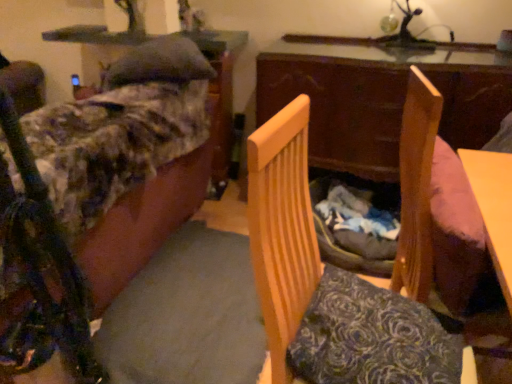
Question: Which is correct: wooden swivel chair at right is inside wooden chair at center, the 1th furniture positioned from the right, or outside of it?

Choices:
 (A) inside
 (B) outside

Answer: (B)

Question: Looking at the image, does wooden swivel chair at right seem bigger or smaller compared to wooden chair at center, the 2th furniture viewed from the left?

Choices:
 (A) small
 (B) big

Answer: (A)

Question: Estimate the real-world distances between objects in this image. Which object is farther from the wooden table at center?

Choices:
 (A) wooden swivel chair at right
 (B) wooden chair at center, the 2th furniture viewed from the left
 (C) fluffy fabric couch at left, positioned as the second furniture in right-to-left order

Answer: (B)

Question: Which of these objects is positioned closest to the wooden chair at center, the 1th furniture positioned from the right?

Choices:
 (A) wooden swivel chair at right
 (B) wooden table at center
 (C) fluffy fabric couch at left, marked as the 1th furniture in a left-to-right arrangement

Answer: (A)